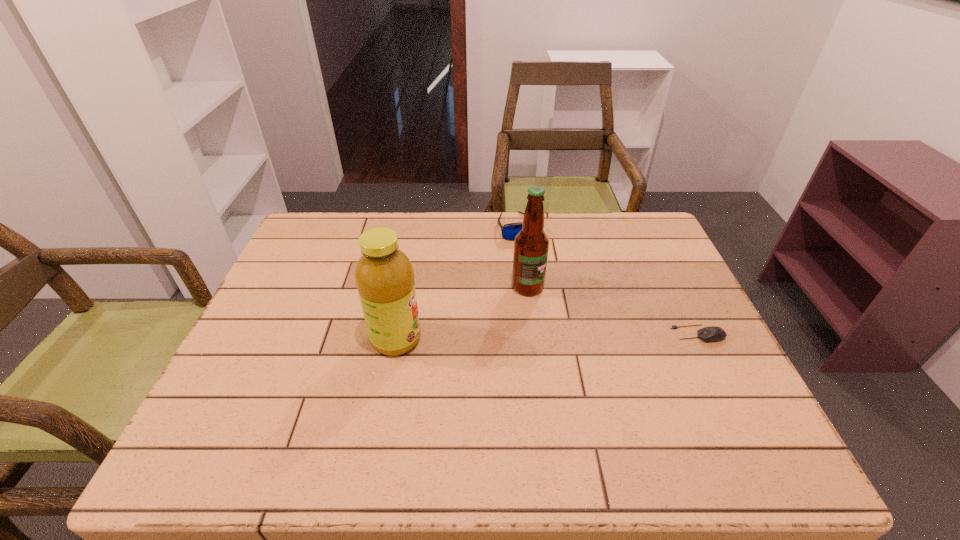
Image resolution: width=960 pixels, height=540 pixels. I want to click on vacant space on the desktop that is between the leftmost object and the rightmost object and is positioned on the label of the third nearest object, so click(x=578, y=336).

Locate an element on the screen. The width and height of the screenshot is (960, 540). vacant space on the desktop that is between the fruit juice and the shortest object and is positioned on the front-facing side of the third tallest object is located at coordinates (564, 336).